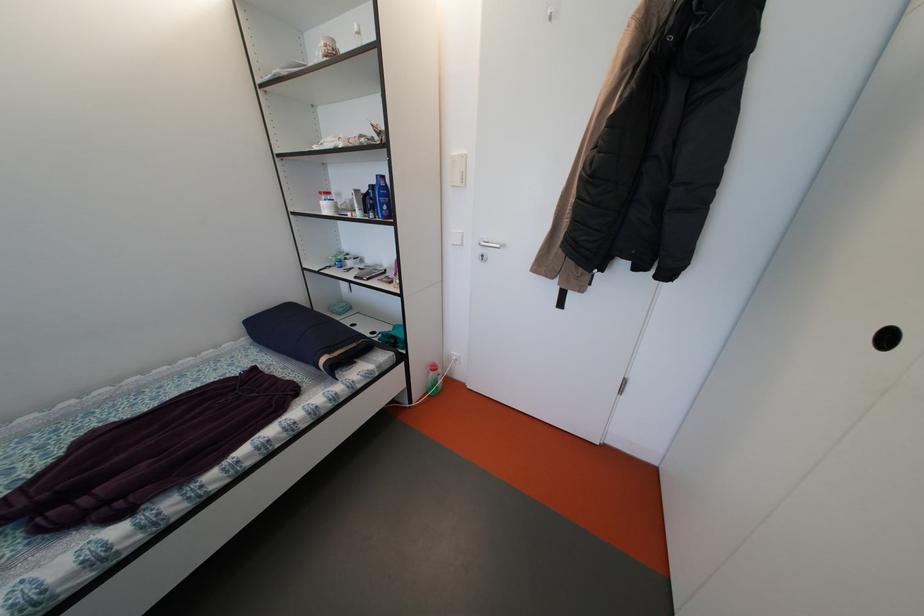
Describe the element at coordinates (489, 244) in the screenshot. I see `a silver door handle` at that location.